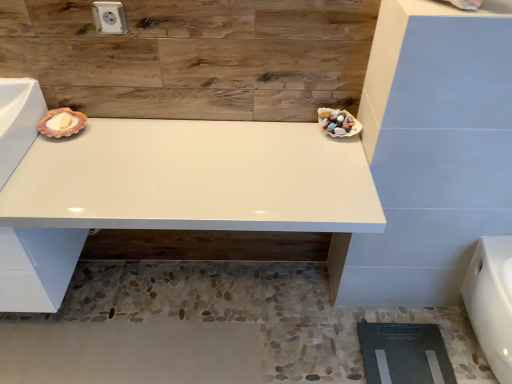
Question: Is white glossy porcelain at lower right wider than white glossy vanity at center?

Choices:
 (A) no
 (B) yes

Answer: (A)

Question: Considering the relative positions of white glossy porcelain at lower right and white glossy vanity at center in the image provided, is white glossy porcelain at lower right in front of white glossy vanity at center?

Choices:
 (A) no
 (B) yes

Answer: (A)

Question: Is white glossy porcelain at lower right aimed at white glossy vanity at center?

Choices:
 (A) yes
 (B) no

Answer: (B)

Question: Considering the relative sizes of white glossy porcelain at lower right and white glossy vanity at center in the image provided, is white glossy porcelain at lower right smaller than white glossy vanity at center?

Choices:
 (A) yes
 (B) no

Answer: (A)

Question: Is white glossy porcelain at lower right far away from white glossy vanity at center?

Choices:
 (A) yes
 (B) no

Answer: (B)

Question: From the image's perspective, is white glossy porcelain at lower right located above or below white plastic electric outlet at upper center?

Choices:
 (A) below
 (B) above

Answer: (A)

Question: From their relative heights in the image, would you say white glossy porcelain at lower right is taller or shorter than white plastic electric outlet at upper center?

Choices:
 (A) short
 (B) tall

Answer: (B)

Question: In terms of width, does white glossy porcelain at lower right look wider or thinner when compared to white plastic electric outlet at upper center?

Choices:
 (A) thin
 (B) wide

Answer: (B)

Question: Is point (477, 309) closer or farther from the camera than point (95, 3)?

Choices:
 (A) farther
 (B) closer

Answer: (A)

Question: Is white glossy vanity at center spatially inside white glossy porcelain at lower right, or outside of it?

Choices:
 (A) outside
 (B) inside

Answer: (A)

Question: From their relative heights in the image, would you say white glossy vanity at center is taller or shorter than white glossy porcelain at lower right?

Choices:
 (A) short
 (B) tall

Answer: (B)

Question: Looking at the image, does white glossy vanity at center seem bigger or smaller compared to white glossy porcelain at lower right?

Choices:
 (A) small
 (B) big

Answer: (B)

Question: From a real-world perspective, is white glossy vanity at center positioned above or below white glossy porcelain at lower right?

Choices:
 (A) above
 (B) below

Answer: (A)

Question: Looking at the image, does white glossy porcelain at lower right seem bigger or smaller compared to white glossy vanity at center?

Choices:
 (A) big
 (B) small

Answer: (B)

Question: Relative to white glossy vanity at center, is white glossy porcelain at lower right in front or behind?

Choices:
 (A) behind
 (B) front

Answer: (A)